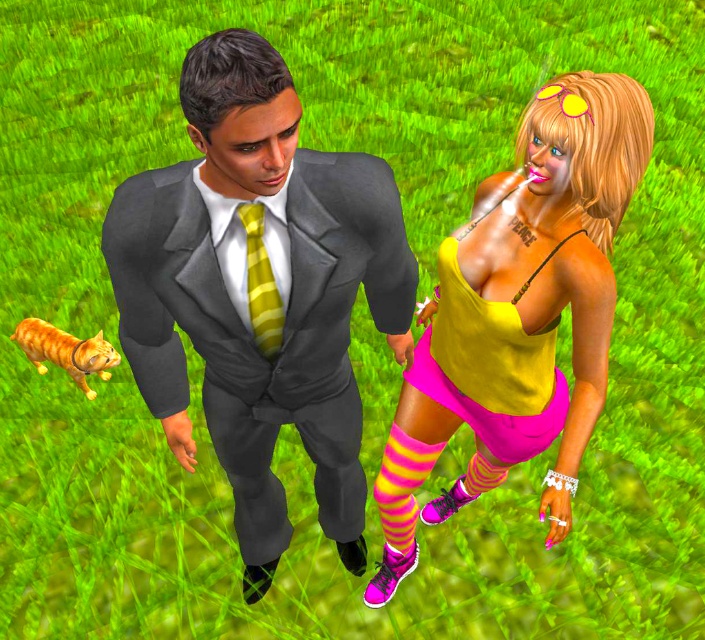
Can you confirm if matte gray suit at center is positioned to the left of yellow striped tie at center?

Correct, you'll find matte gray suit at center to the left of yellow striped tie at center.

Between point (177, 225) and point (259, 269), which one is positioned behind?

Point (259, 269)

Locate an element on the screen. The height and width of the screenshot is (640, 705). matte gray suit at center is located at coordinates (245, 296).

Does pink/yellow striped sock at lower center appear on the left side of yellow striped tie at center?

→ In fact, pink/yellow striped sock at lower center is to the right of yellow striped tie at center.

Who is taller, pink/yellow striped sock at lower center or yellow striped tie at center?

pink/yellow striped sock at lower center is taller.

Find the location of a particular element. pink/yellow striped sock at lower center is located at coordinates (403, 484).

Between yellow matte tank top at center and pink/yellow striped sock at lower center, which one appears on the right side from the viewer's perspective?

yellow matte tank top at center

I want to click on yellow matte tank top at center, so click(x=517, y=314).

Is point (474, 273) more distant than point (429, 449)?

No, (474, 273) is in front of (429, 449).

Find the location of a particular element. The image size is (705, 640). yellow matte tank top at center is located at coordinates (517, 314).